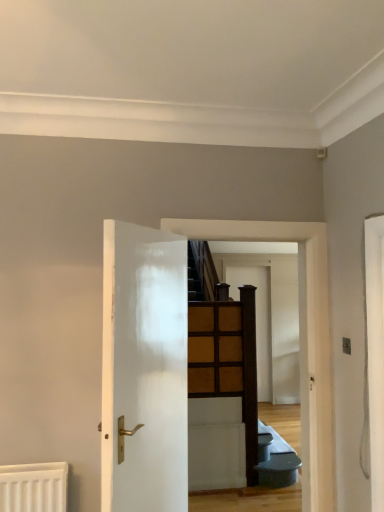
Question: Is white glossy door at center, the 2th door from the back, spatially inside wooden at center, which appears as the 2th door when viewed from the left, or outside of it?

Choices:
 (A) outside
 (B) inside

Answer: (A)

Question: From a real-world perspective, is white glossy door at center, acting as the 2th door starting from the right, positioned above or below wooden at center, placed as the 1th door when sorted from back to front?

Choices:
 (A) below
 (B) above

Answer: (B)

Question: Is white glossy door at center, the first door positioned from the left, taller or shorter than wooden at center, placed as the 1th door when sorted from back to front?

Choices:
 (A) short
 (B) tall

Answer: (A)

Question: Is wooden at center, which ranks as the first door in right-to-left order, to the left or to the right of white glossy door at center, acting as the 2th door starting from the right, in the image?

Choices:
 (A) left
 (B) right

Answer: (B)

Question: From a real-world perspective, is wooden at center, which ranks as the second door in front-to-back order, physically located above or below white glossy door at center, the 2th door from the back?

Choices:
 (A) above
 (B) below

Answer: (B)

Question: Does point (249, 279) appear closer or farther from the camera than point (165, 484)?

Choices:
 (A) farther
 (B) closer

Answer: (A)

Question: Is wooden at center, placed as the 1th door when sorted from back to front, bigger or smaller than white glossy door at center, the 2th door from the back?

Choices:
 (A) small
 (B) big

Answer: (A)